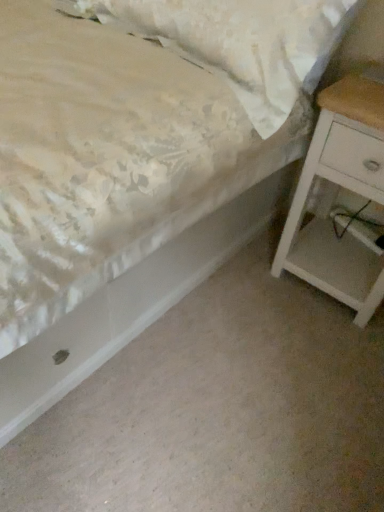
Question: From a real-world perspective, is white matte nightstand at right physically located above or below floral fabric pillow at upper left?

Choices:
 (A) below
 (B) above

Answer: (A)

Question: In the image, is white matte nightstand at right on the left side or the right side of floral fabric pillow at upper left?

Choices:
 (A) right
 (B) left

Answer: (A)

Question: Is white matte nightstand at right spatially inside floral fabric pillow at upper left, or outside of it?

Choices:
 (A) inside
 (B) outside

Answer: (B)

Question: From a real-world perspective, is floral fabric pillow at upper left physically located above or below white matte nightstand at right?

Choices:
 (A) above
 (B) below

Answer: (A)

Question: Which is correct: floral fabric pillow at upper left is inside white matte nightstand at right, or outside of it?

Choices:
 (A) inside
 (B) outside

Answer: (B)

Question: Is floral fabric pillow at upper left to the left or to the right of white matte nightstand at right in the image?

Choices:
 (A) right
 (B) left

Answer: (B)

Question: Looking at the image, does floral fabric pillow at upper left seem bigger or smaller compared to white matte nightstand at right?

Choices:
 (A) small
 (B) big

Answer: (B)